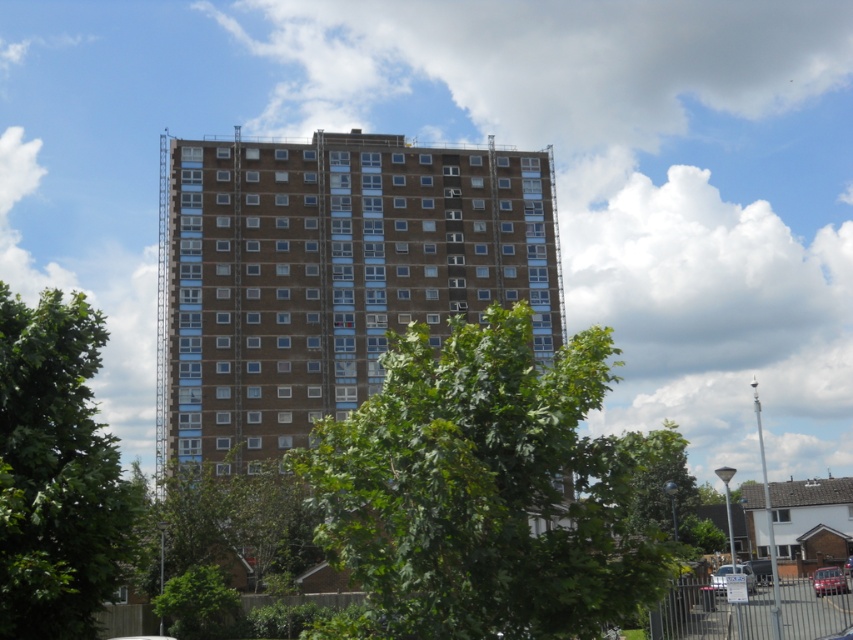
Question: Among these points, which one is nearest to the camera?

Choices:
 (A) (846, 573)
 (B) (840, 576)

Answer: (A)

Question: Does green leafy tree at center appear over metallic red car at lower right?

Choices:
 (A) no
 (B) yes

Answer: (B)

Question: Does brown brick building at center have a greater width compared to metallic red car at lower right?

Choices:
 (A) yes
 (B) no

Answer: (A)

Question: Which of these objects is positioned closest to the green leafy tree at left?

Choices:
 (A) silver metallic car at lower right
 (B) metallic silver car at center

Answer: (A)

Question: From the image, what is the correct spatial relationship of brown brick building at center in relation to green leafy tree at lower left?

Choices:
 (A) left
 (B) right

Answer: (A)

Question: Which point is farther to the camera?

Choices:
 (A) (96, 540)
 (B) (628, 493)
 (C) (223, 630)
 (D) (730, 570)

Answer: (D)